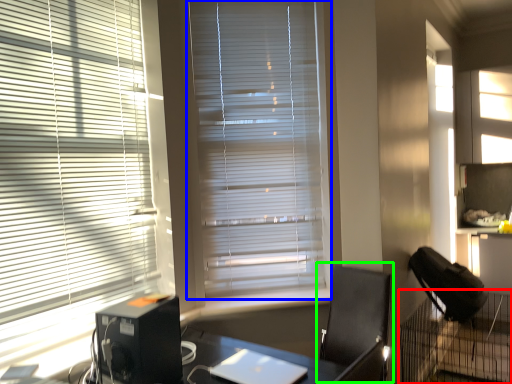
Question: Which is farther away from computer desk (highlighted by a red box)? window blind (highlighted by a blue box) or computer chair (highlighted by a green box)?

Choices:
 (A) window blind
 (B) computer chair

Answer: (A)